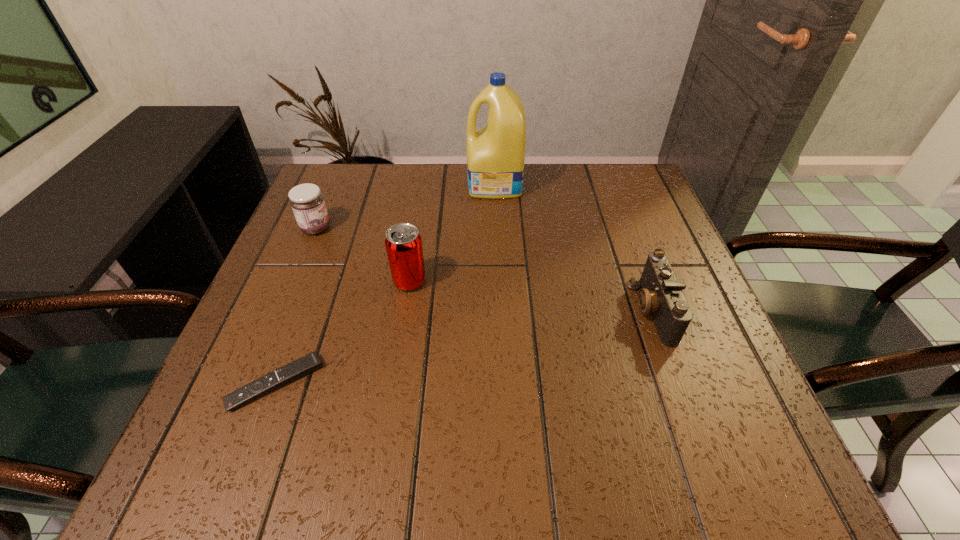
Where is `free region that satisfies the following two spatial constraints: 1. on the front label of the jam; 2. on the back side of the nearest object`? free region that satisfies the following two spatial constraints: 1. on the front label of the jam; 2. on the back side of the nearest object is located at coordinates (251, 383).

Where is `free spot that satisfies the following two spatial constraints: 1. on the front label of the second farthest object; 2. on the right side of the soda can`? free spot that satisfies the following two spatial constraints: 1. on the front label of the second farthest object; 2. on the right side of the soda can is located at coordinates [x=294, y=281].